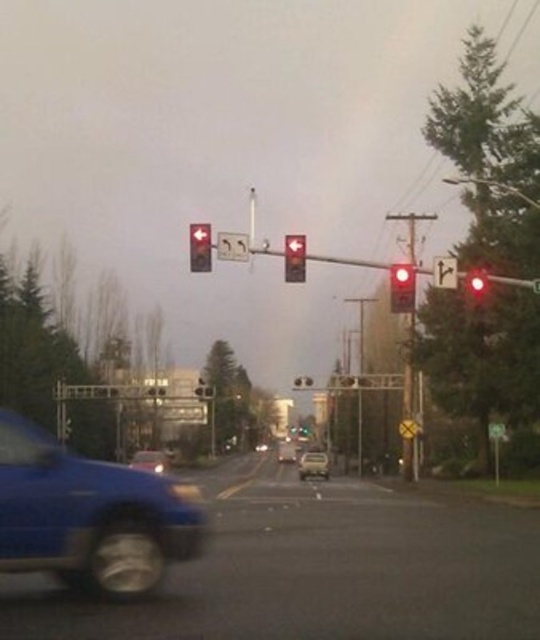
Question: Is matte red traffic light at right bigger than blue matte car at lower left?

Choices:
 (A) yes
 (B) no

Answer: (B)

Question: Does matte silver suv at center have a lesser width compared to metallic red traffic light at upper center?

Choices:
 (A) yes
 (B) no

Answer: (A)

Question: Which object appears closest to the camera in this image?

Choices:
 (A) metallic silver traffic light at center
 (B) metallic reflective arrow at upper right
 (C) red matte traffic light at right

Answer: (B)

Question: Observing the image, what is the correct spatial positioning of matte red traffic light at right in reference to metallic red traffic light at upper center?

Choices:
 (A) above
 (B) below

Answer: (A)

Question: Which object is farther from the camera taking this photo?

Choices:
 (A) metallic reflective arrow at upper right
 (B) metallic silver sedan at center
 (C) matte silver suv at center
 (D) red matte traffic light at right

Answer: (C)

Question: Which object appears closest to the camera in this image?

Choices:
 (A) metallic red traffic light at upper center
 (B) metallic silver sedan at center

Answer: (B)